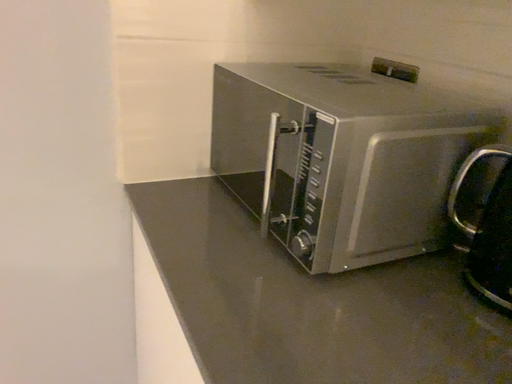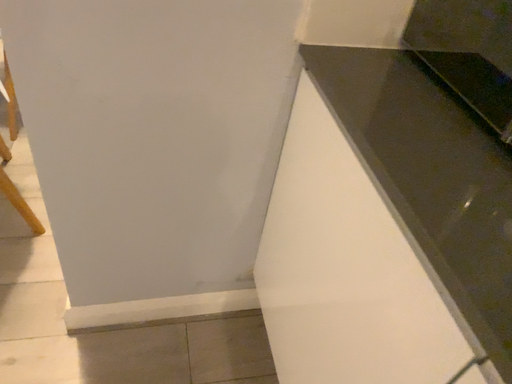
Question: How did the camera likely rotate when shooting the video?

Choices:
 (A) rotated upward
 (B) rotated downward

Answer: (B)